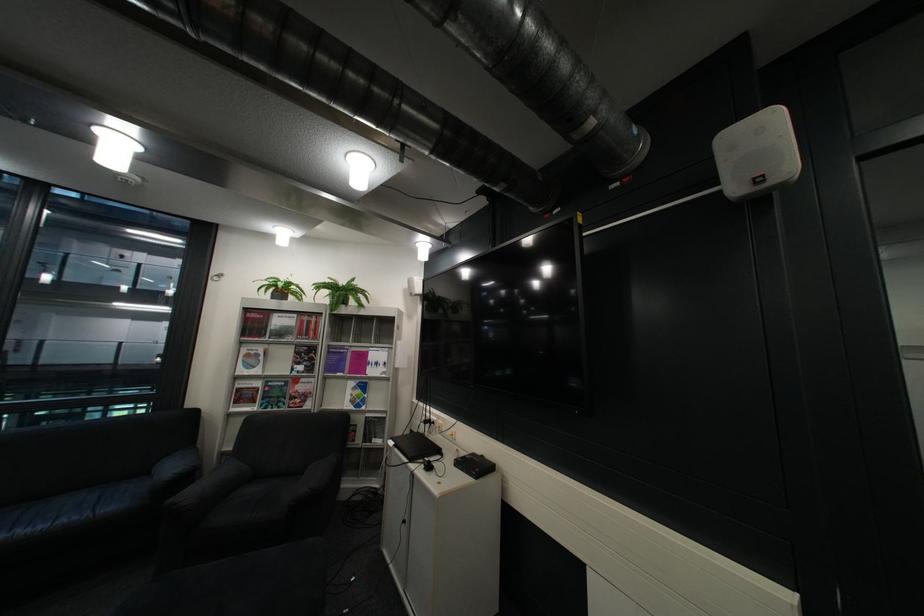
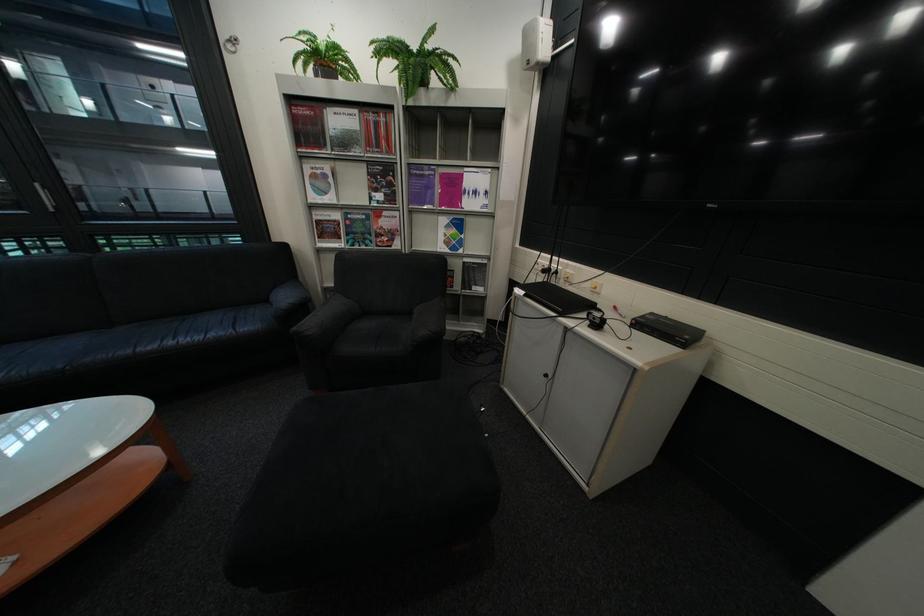
Locate, in the second image, the point that corresponds to (456,437) in the first image.

(589, 288)